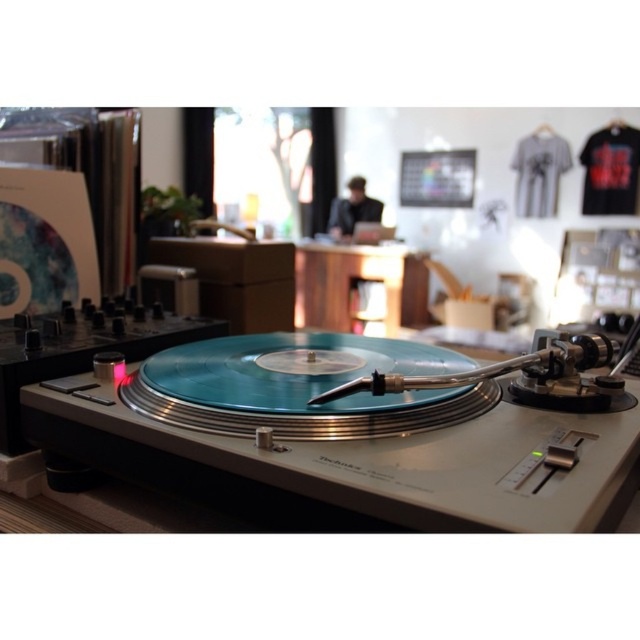
Between teal vinyl record player at center and wooden table at center, which one is positioned lower?

Positioned lower is teal vinyl record player at center.

Who is more forward, [579,442] or [340,317]?

Point [579,442] is more forward.

Does point (422, 502) lie in front of point (346, 330)?

Yes.

Image resolution: width=640 pixels, height=640 pixels. Identify the location of teal vinyl record player at center. (344, 438).

Consider the image. Can you confirm if wooden table at center is taller than black fabric dj at center?

Yes.

Which is in front, point (397, 266) or point (333, 237)?

Positioned in front is point (397, 266).

Who is more distant from viewer, (392, 333) or (330, 225)?

Point (330, 225)

Image resolution: width=640 pixels, height=640 pixels. Identify the location of wooden table at center. (360, 280).

Can you confirm if teal vinyl record player at center is bigger than black fabric dj at center?

Indeed, teal vinyl record player at center has a larger size compared to black fabric dj at center.

Between teal vinyl record player at center and black fabric dj at center, which one is positioned lower?

teal vinyl record player at center is below.

Between point (324, 381) and point (360, 182), which one is positioned in front?

Positioned in front is point (324, 381).

The width and height of the screenshot is (640, 640). Identify the location of teal vinyl record player at center. (344, 438).